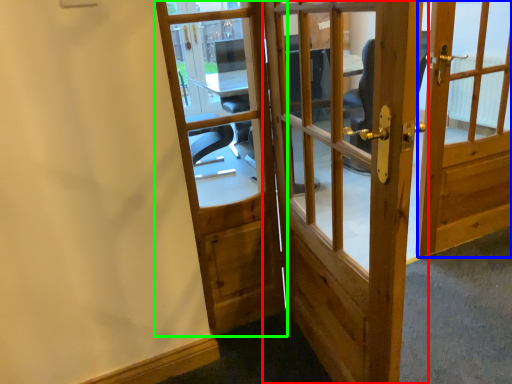
Question: Which object is positioned farthest from door (highlighted by a red box)? Select from door (highlighted by a blue box) and door (highlighted by a green box).

Choices:
 (A) door
 (B) door

Answer: (B)